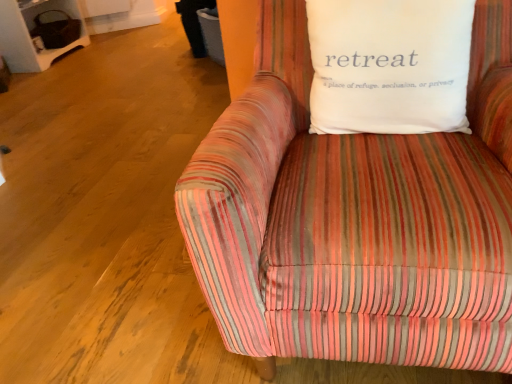
Question: In terms of height, does white cotton pillow at upper right look taller or shorter compared to striped fabric couch at center?

Choices:
 (A) tall
 (B) short

Answer: (B)

Question: Is point (333, 49) closer or farther from the camera than point (315, 339)?

Choices:
 (A) farther
 (B) closer

Answer: (A)

Question: Based on their sizes in the image, would you say white cotton pillow at upper right is bigger or smaller than striped fabric couch at center?

Choices:
 (A) big
 (B) small

Answer: (B)

Question: Considering the positions of striped fabric couch at center and white cotton pillow at upper right in the image, is striped fabric couch at center wider or thinner than white cotton pillow at upper right?

Choices:
 (A) wide
 (B) thin

Answer: (A)

Question: Is striped fabric couch at center situated inside white cotton pillow at upper right or outside?

Choices:
 (A) outside
 (B) inside

Answer: (A)

Question: In terms of height, does striped fabric couch at center look taller or shorter compared to white cotton pillow at upper right?

Choices:
 (A) tall
 (B) short

Answer: (A)

Question: From the image's perspective, relative to white cotton pillow at upper right, is striped fabric couch at center above or below?

Choices:
 (A) below
 (B) above

Answer: (A)